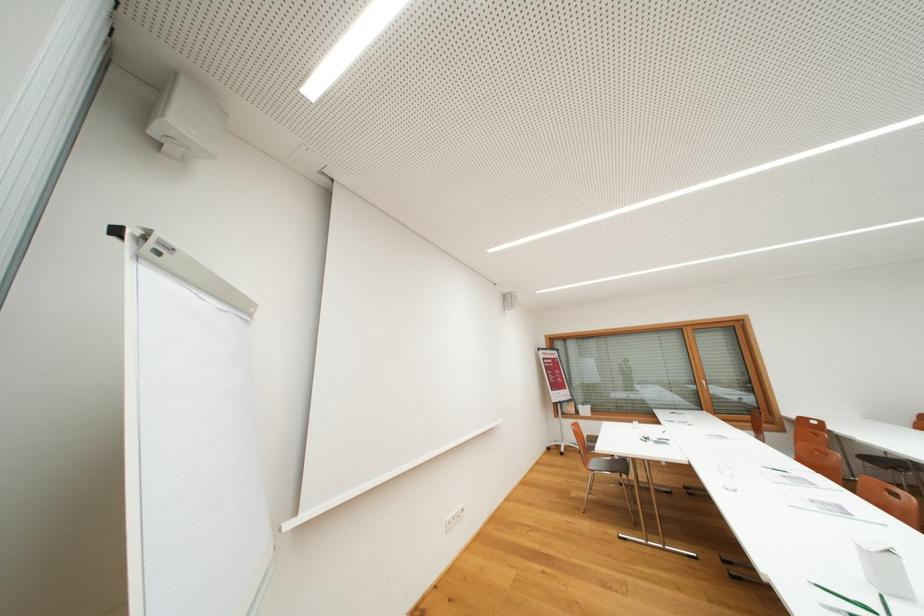
Where is `white screen pull-bar`? Image resolution: width=924 pixels, height=616 pixels. white screen pull-bar is located at coordinates (191, 272).